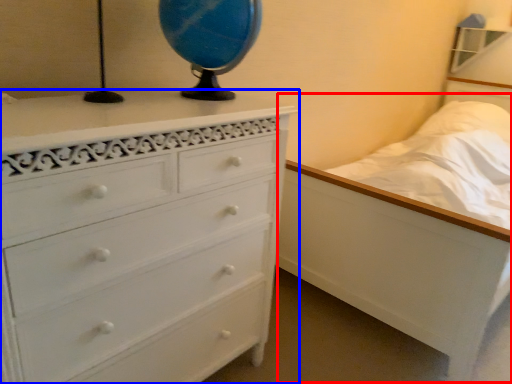
Question: Which of the following is the closest to the observer, bed (highlighted by a red box) or chest of drawers (highlighted by a blue box)?

Choices:
 (A) bed
 (B) chest of drawers

Answer: (B)